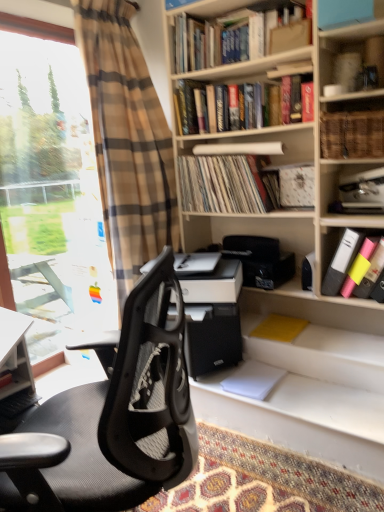
Locate an element on the screen. vacant area that is situated to the right of white paper at lower center, which appears as the first paperback book when ordered from the bottom is located at coordinates (303, 391).